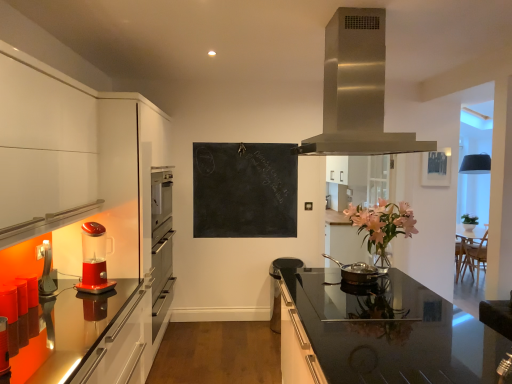
Where is `vacant area on top of black chalkboard at center (from a real-world perspective)`? vacant area on top of black chalkboard at center (from a real-world perspective) is located at coordinates (245, 146).